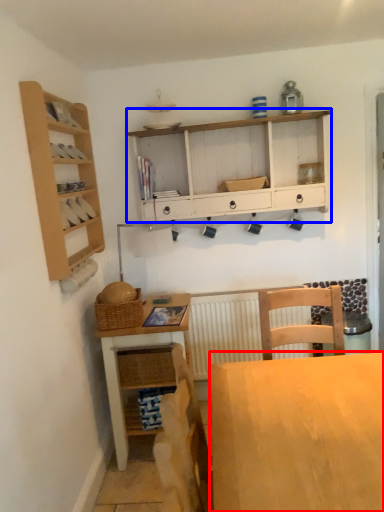
Question: Among these objects, which one is farthest to the camera, desk (highlighted by a red box) or cabinetry (highlighted by a blue box)?

Choices:
 (A) desk
 (B) cabinetry

Answer: (B)